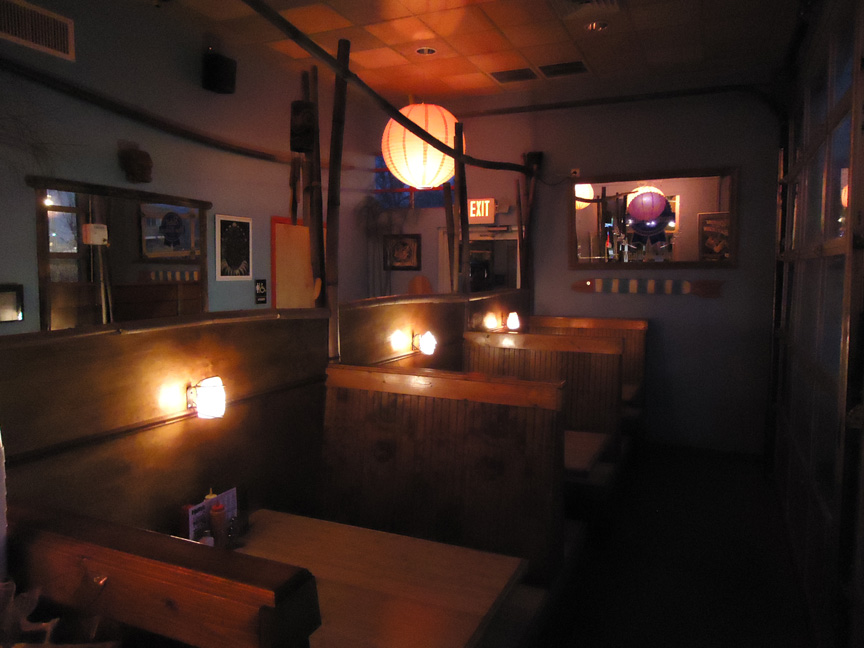
Where is `partition`? partition is located at coordinates (270, 359).